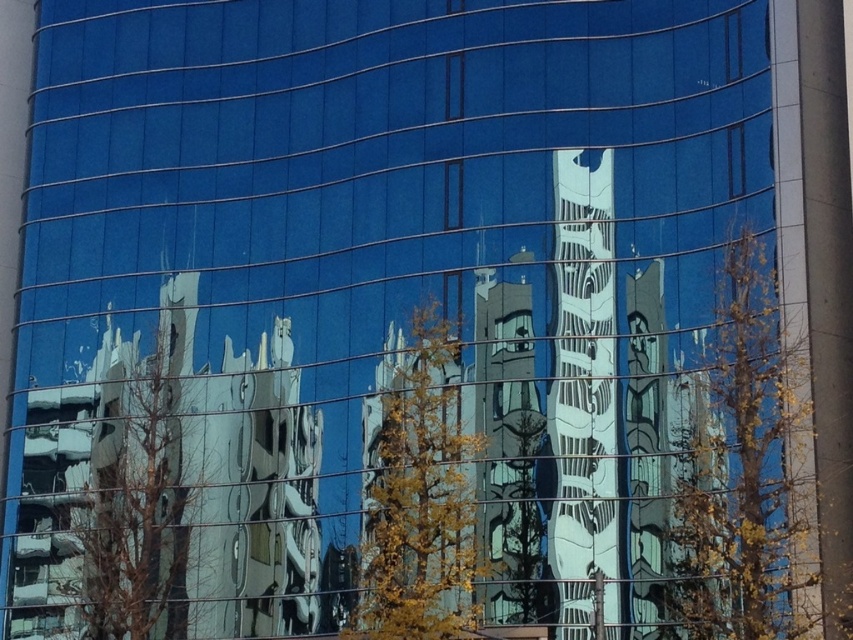
Question: Can you confirm if yellow-green leaves at center is positioned to the right of green matte tree at center?

Choices:
 (A) yes
 (B) no

Answer: (B)

Question: Which object is the closest to the brown leafy tree at left?

Choices:
 (A) yellow leafy tree at right
 (B) yellow-green leaves at center
 (C) green matte tree at center

Answer: (B)

Question: In this image, where is yellow leafy tree at right located relative to yellow-green leaves at center?

Choices:
 (A) right
 (B) left

Answer: (A)

Question: Considering the real-world distances, which object is closest to the green matte tree at center?

Choices:
 (A) yellow-green leaves at center
 (B) brown leafy tree at left
 (C) yellow leafy tree at right

Answer: (A)

Question: Is brown leafy tree at left to the right of green matte tree at center from the viewer's perspective?

Choices:
 (A) yes
 (B) no

Answer: (B)

Question: Which object is the farthest from the green matte tree at center?

Choices:
 (A) yellow leafy tree at right
 (B) brown leafy tree at left
 (C) yellow-green leaves at center

Answer: (B)